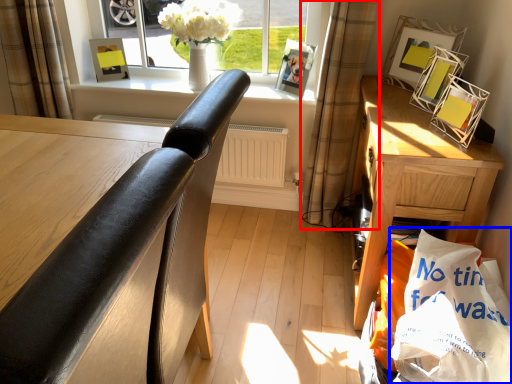
Question: Which object is closer to the camera taking this photo, curtain (highlighted by a red box) or shopping bag (highlighted by a blue box)?

Choices:
 (A) curtain
 (B) shopping bag

Answer: (B)